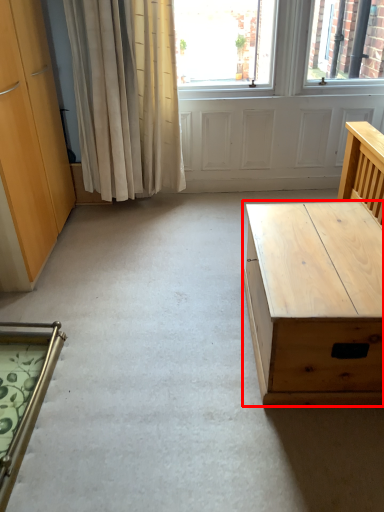
Question: From the image's perspective, considering the relative positions of desk (annotated by the red box) and chair in the image provided, where is desk (annotated by the red box) located with respect to the staircase?

Choices:
 (A) above
 (B) below

Answer: (A)